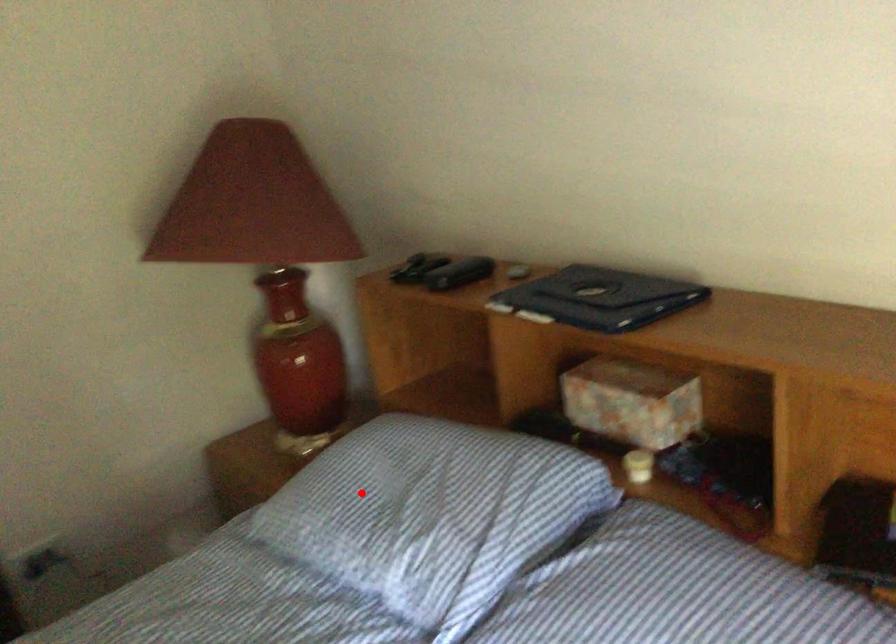
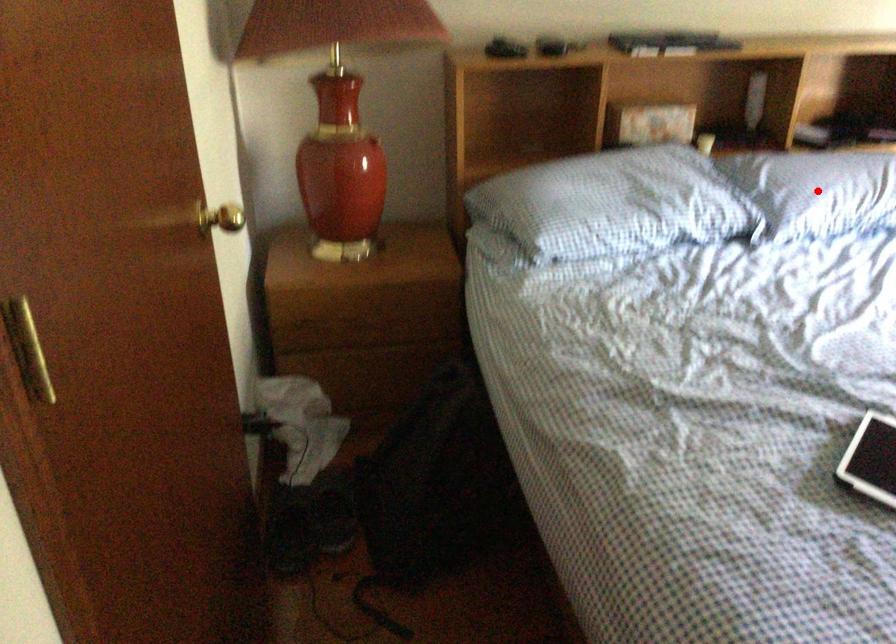
I am providing you with two images of the same scene from different viewpoints. A red point is marked on the first image and another point is marked on the second image. Is the marked point in image1 the same physical position as the marked point in image2?

No